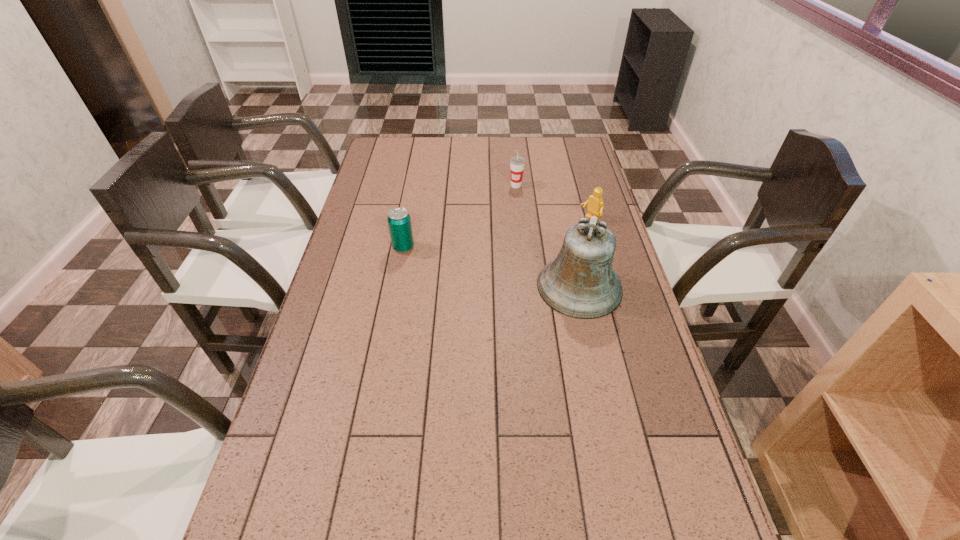
Where is `vacant space that is in between the leftmost object and the nearest object`? vacant space that is in between the leftmost object and the nearest object is located at coordinates (492, 267).

Locate an element on the screen. free space between the leftmost object and the nearest object is located at coordinates (492, 267).

Select which object appears as the second closest to the cup. Please provide its 2D coordinates. Your answer should be formatted as a tuple, i.e. [(x, y)], where the tuple contains the x and y coordinates of a point satisfying the conditions above.

[(580, 283)]

Select which object is the closest to the cup. Please provide its 2D coordinates. Your answer should be formatted as a tuple, i.e. [(x, y)], where the tuple contains the x and y coordinates of a point satisfying the conditions above.

[(595, 206)]

Locate an element on the screen. This screenshot has height=540, width=960. free region that satisfies the following two spatial constraints: 1. on the back side of the Lego; 2. on the right side of the tallest object is located at coordinates (564, 220).

This screenshot has width=960, height=540. What are the coordinates of `free space in the image that satisfies the following two spatial constraints: 1. on the back side of the beer can; 2. on the left side of the Lego` in the screenshot? It's located at (409, 220).